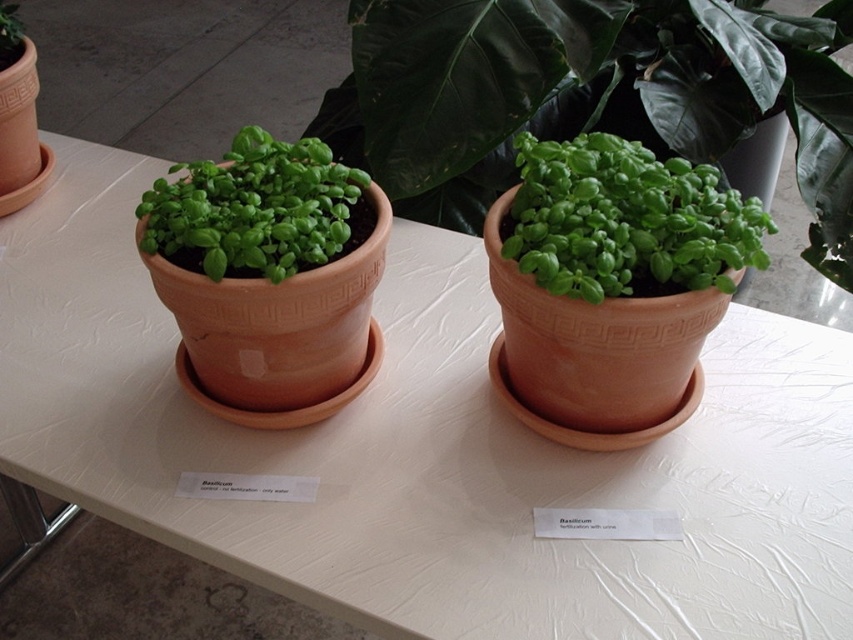
Question: Is green matte pot at center positioned in front of green matte basil at center?

Choices:
 (A) no
 (B) yes

Answer: (A)

Question: Observing the image, what is the correct spatial positioning of green matte pot at center in reference to green matte basil at left?

Choices:
 (A) above
 (B) below

Answer: (A)

Question: Which point is farther to the camera?

Choices:
 (A) green matte basil at center
 (B) green matte pot at center

Answer: (B)

Question: Among these points, which one is nearest to the camera?

Choices:
 (A) (253, 188)
 (B) (622, 112)
 (C) (643, 278)

Answer: (C)

Question: Estimate the real-world distances between objects in this image. Which object is farther from the green matte basil at left?

Choices:
 (A) green matte basil at center
 (B) green matte pot at center

Answer: (B)

Question: Observing the image, what is the correct spatial positioning of green matte basil at center in reference to green matte basil at left?

Choices:
 (A) right
 (B) left

Answer: (A)